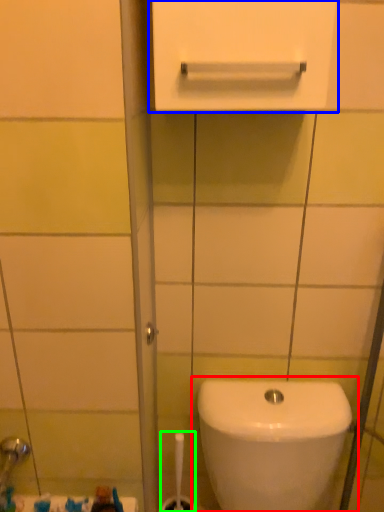
Question: Considering the real-world distances, which object is closest to toilet (highlighted by a red box)? medicine cabinet (highlighted by a blue box) or brush (highlighted by a green box).

Choices:
 (A) medicine cabinet
 (B) brush

Answer: (B)